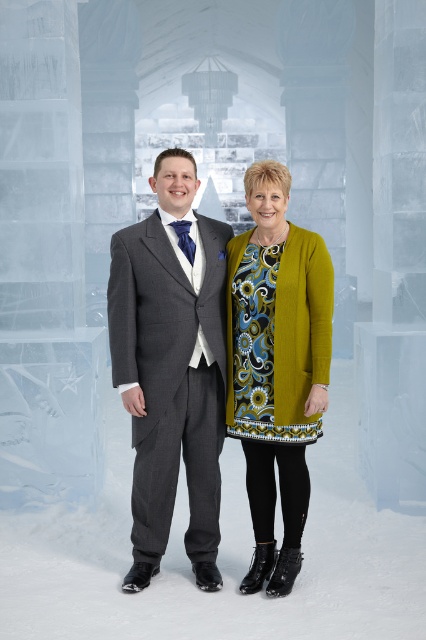
Is matte green cardigan at center closer to camera compared to floral print jersey dress at center?

Yes, it is.

Between point (285, 454) and point (264, 259), which one is positioned in front?

Point (264, 259) is in front.

The image size is (426, 640). Describe the element at coordinates (276, 365) in the screenshot. I see `matte green cardigan at center` at that location.

At what (x,y) coordinates should I click in order to perform the action: click on matte green cardigan at center. Please return your answer as a coordinate pair (x, y). The image size is (426, 640). Looking at the image, I should click on (276, 365).

Between gray pinstripe suit at center and matte green cardigan at center, which one appears on the left side from the viewer's perspective?

Positioned to the left is gray pinstripe suit at center.

Does gray pinstripe suit at center lie behind matte green cardigan at center?

No, gray pinstripe suit at center is in front of matte green cardigan at center.

Is point (175, 234) less distant than point (299, 435)?

No.

You are a GUI agent. You are given a task and a screenshot of the screen. Output one action in this format:
    pyautogui.click(x=<x>, y=<y>)
    Task: Click on the gray pinstripe suit at center
    This screenshot has height=640, width=426.
    Given the screenshot: What is the action you would take?
    pyautogui.click(x=172, y=365)

Which of these two, gray pinstripe suit at center or floral print jersey dress at center, stands shorter?

floral print jersey dress at center is shorter.

Is point (140, 536) more distant than point (296, 276)?

Yes, it is behind point (296, 276).

Find the location of a particular element. This screenshot has height=640, width=426. gray pinstripe suit at center is located at coordinates (172, 365).